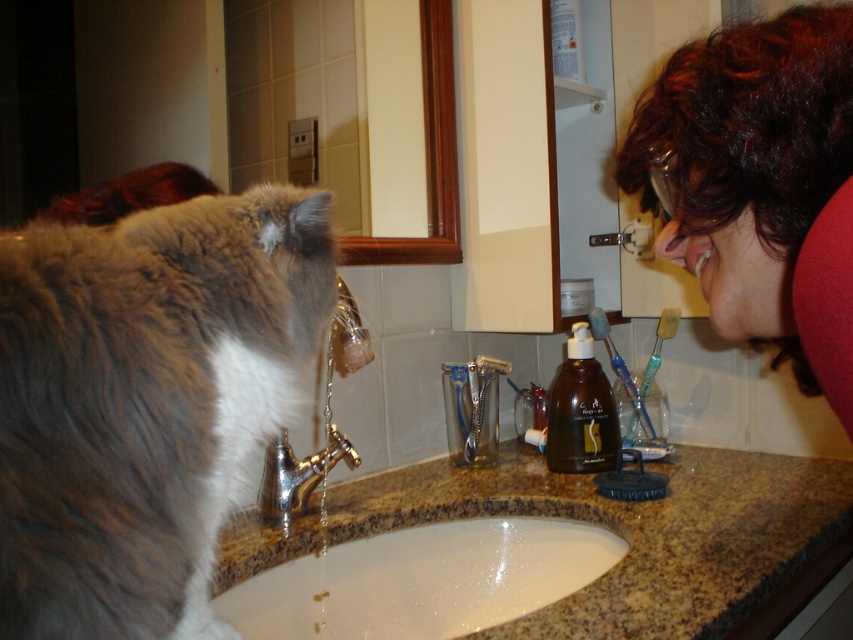
Is matte red hair at upper right bigger than brown matte bottle at center?

Correct, matte red hair at upper right is larger in size than brown matte bottle at center.

Based on the photo, which of these two, matte red hair at upper right or brown matte bottle at center, stands taller?

With more height is matte red hair at upper right.

Who is more distant from viewer, (751,252) or (581,352)?

Positioned behind is point (581,352).

The height and width of the screenshot is (640, 853). What are the coordinates of `matte red hair at upper right` in the screenshot? It's located at (753, 177).

This screenshot has width=853, height=640. Find the location of `granite countertop at sink`. granite countertop at sink is located at coordinates (637, 534).

Is point (608, 604) closer to viewer compared to point (589, 387)?

Yes, it is.

Describe the element at coordinates (637, 534) in the screenshot. This screenshot has width=853, height=640. I see `granite countertop at sink` at that location.

The width and height of the screenshot is (853, 640). Identify the location of granite countertop at sink. (637, 534).

Measure the distance between point (550,448) and camera.

Point (550,448) and camera are 1.38 meters apart from each other.

In the scene shown: Is brown matte bottle at center to the left of gold metallic faucet at sink center from the viewer's perspective?

Incorrect, brown matte bottle at center is not on the left side of gold metallic faucet at sink center.

This screenshot has width=853, height=640. I want to click on brown matte bottle at center, so click(581, 412).